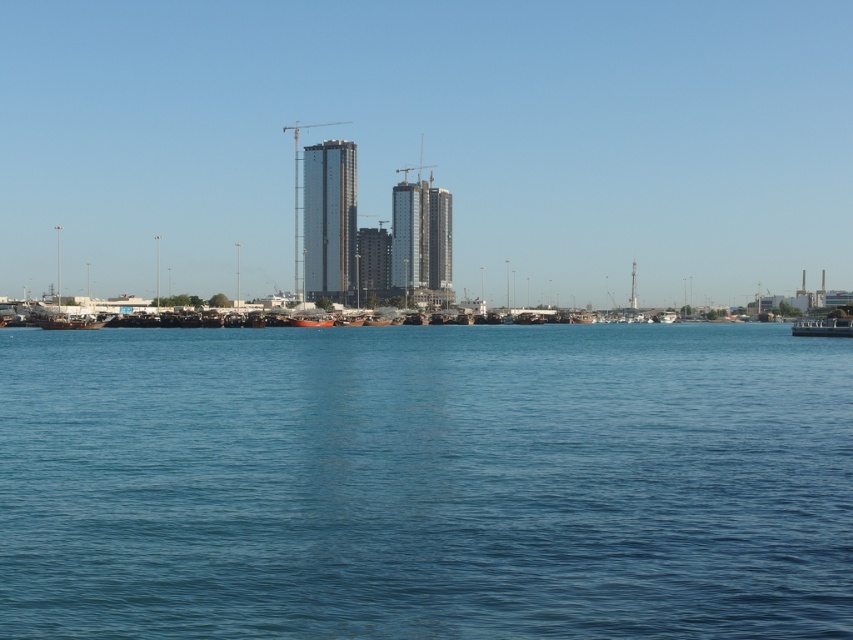
You are a photographer standing at the waterfront. You want to take a photo of the wooden boat at lower right and the red wooden boat at center without any obstructions. Based on their positions, which boat should you focus on first to ensure it appears in the foreground of your photo?

The wooden boat at lower right is in front of the red wooden boat at center, so focusing on the wooden boat at lower right first will ensure it appears in the foreground of your photo.

You are a photographer standing at the waterfront. You want to capture a photo of the red wooden boat at center without the glassy metallic skyscraper at center blocking it. Is this possible given their positions?

The glassy metallic skyscraper at center is positioned over the red wooden boat at center, so it will block the view of the red wooden boat at center. You cannot capture the photo without the skyscraper blocking it.